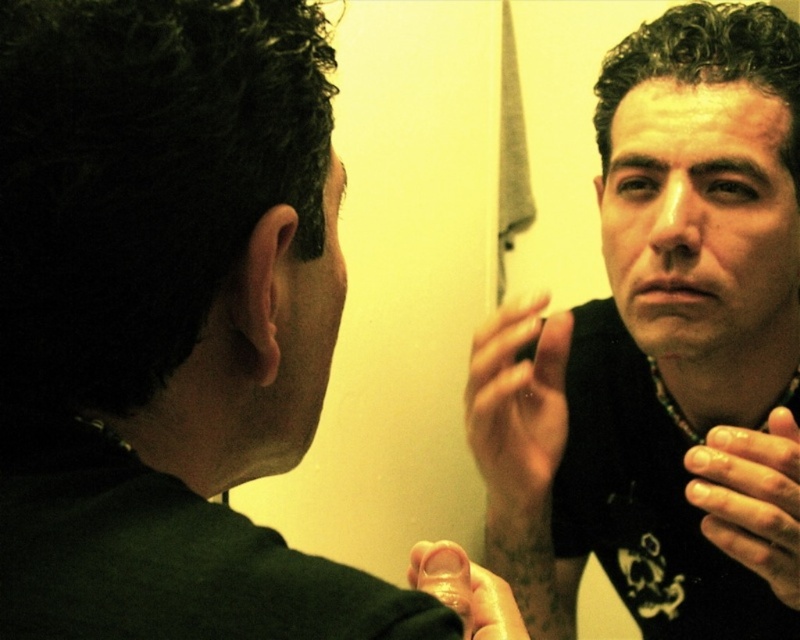
Question: Among these objects, which one is nearest to the camera?

Choices:
 (A) dark matte skin at center
 (B) smooth skin hand at center
 (C) matte black face at center
 (D) dark green shirt at upper left

Answer: (D)

Question: Estimate the real-world distances between objects in this image. Which object is closer to the smooth skin finger at center?

Choices:
 (A) smooth skin hand at center
 (B) satin black phone at center

Answer: (A)

Question: Can you confirm if black matte shirt at center is bigger than dark matte skin at center?

Choices:
 (A) no
 (B) yes

Answer: (B)

Question: Which point is farther to the camera?

Choices:
 (A) black matte shirt at center
 (B) dark green shirt at upper left
 (C) dark matte skin at center

Answer: (A)

Question: Is the position of black matte shirt at center more distant than that of smooth skin hand at center?

Choices:
 (A) no
 (B) yes

Answer: (B)

Question: Can you confirm if black matte shirt at center is positioned to the left of smooth skin finger at center?

Choices:
 (A) yes
 (B) no

Answer: (B)